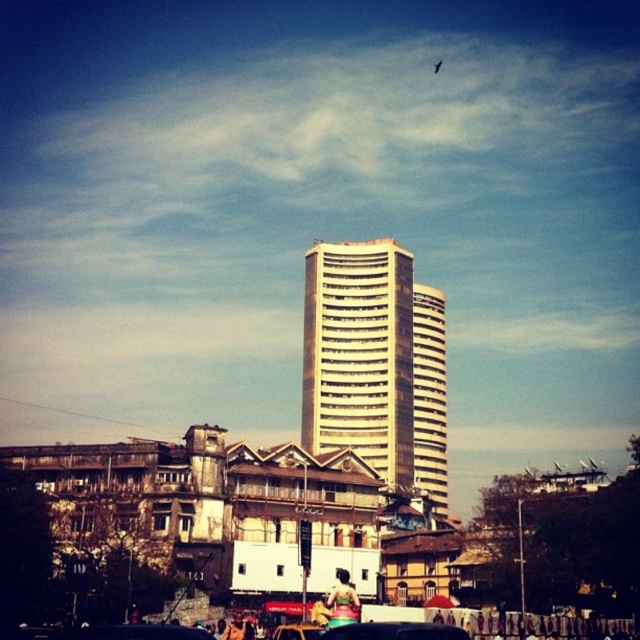
Is white glossy building at center smaller than metallic gold car at center?

No.

Between white glossy building at center and metallic gold car at center, which one has more height?

white glossy building at center is taller.

Find the location of `white glossy building at center`. white glossy building at center is located at coordinates (376, 364).

The width and height of the screenshot is (640, 640). Find the location of `white glossy building at center`. white glossy building at center is located at coordinates (376, 364).

Is white glossy building at center below metallic silver car at center?

No.

Can you confirm if white glossy building at center is positioned above metallic silver car at center?

Indeed, white glossy building at center is positioned over metallic silver car at center.

Is point (413, 296) positioned behind point (358, 636)?

Yes, it is.

Find the location of a particular element. The height and width of the screenshot is (640, 640). white glossy building at center is located at coordinates (376, 364).

Who is higher up, metallic silver car at center or metallic gold car at center?

metallic silver car at center is above.

Who is positioned more to the left, metallic silver car at center or metallic gold car at center?

From the viewer's perspective, metallic gold car at center appears more on the left side.

Is point (344, 627) closer to viewer compared to point (284, 628)?

Yes, point (344, 627) is in front of point (284, 628).

The image size is (640, 640). What are the coordinates of `metallic silver car at center` in the screenshot? It's located at (394, 632).